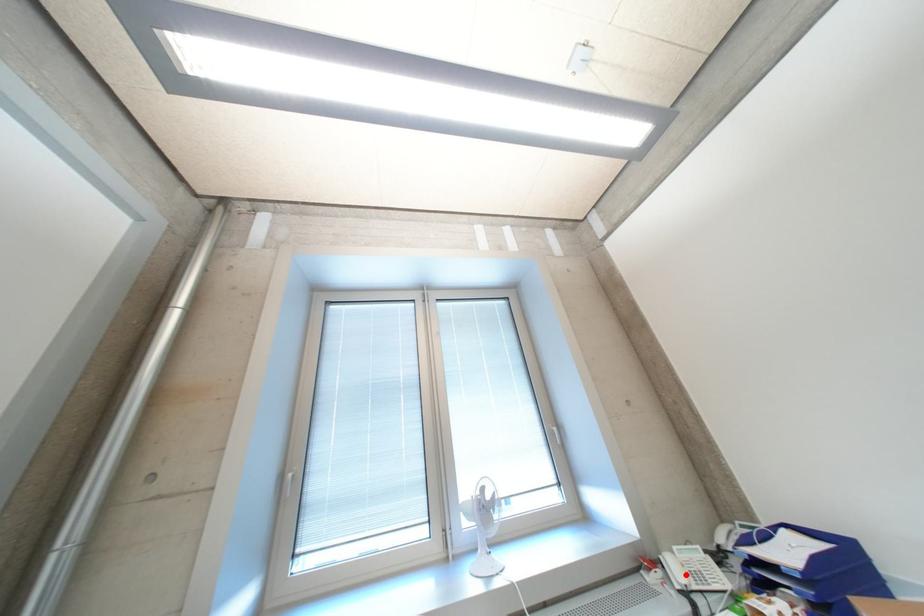
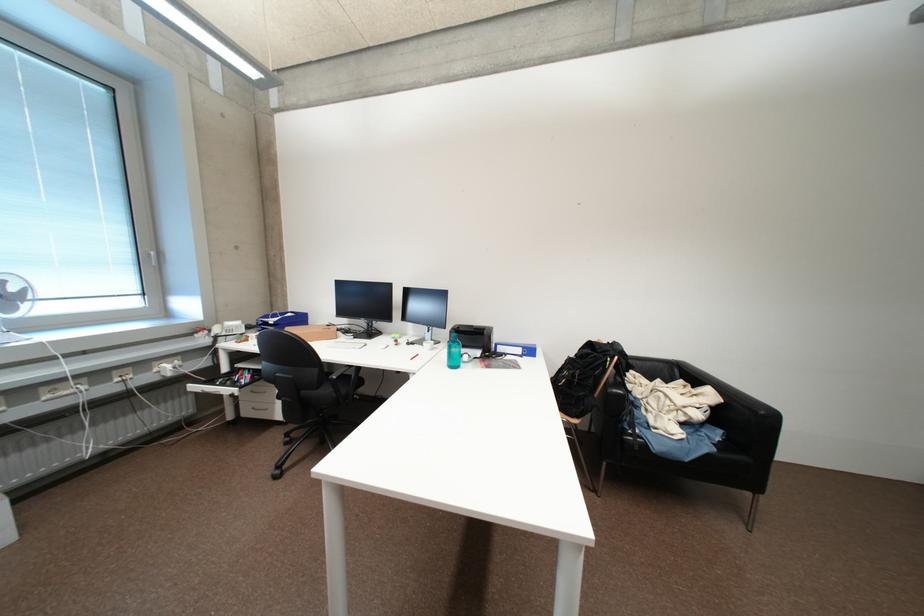
Find the pixel in the second image that matches the highlighted location in the first image.

(225, 331)